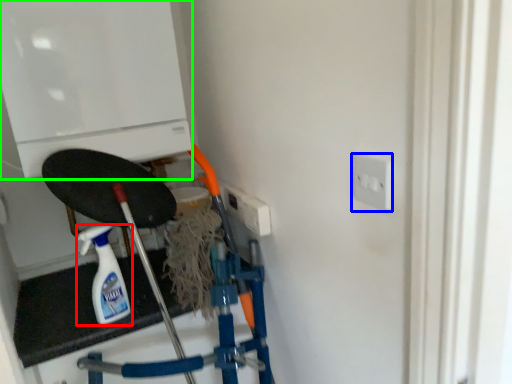
Question: Which object is the closest to the bottle (highlighted by a red box)? Choose among these: socket (highlighted by a blue box) or appliance (highlighted by a green box).

Choices:
 (A) socket
 (B) appliance

Answer: (B)